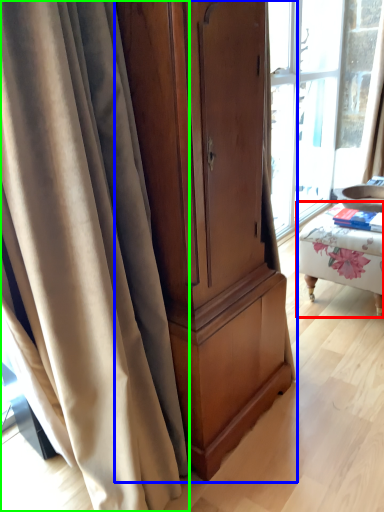
Question: Which object is positioned farthest from furniture (highlighted by a red box)? Select from cabinetry (highlighted by a blue box) and curtain (highlighted by a green box).

Choices:
 (A) cabinetry
 (B) curtain

Answer: (B)